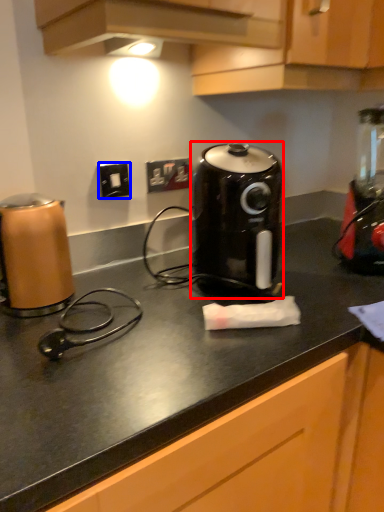
Question: Which point is further to the camera, kitchen appliance (highlighted by a red box) or electric outlet (highlighted by a blue box)?

Choices:
 (A) kitchen appliance
 (B) electric outlet

Answer: (B)